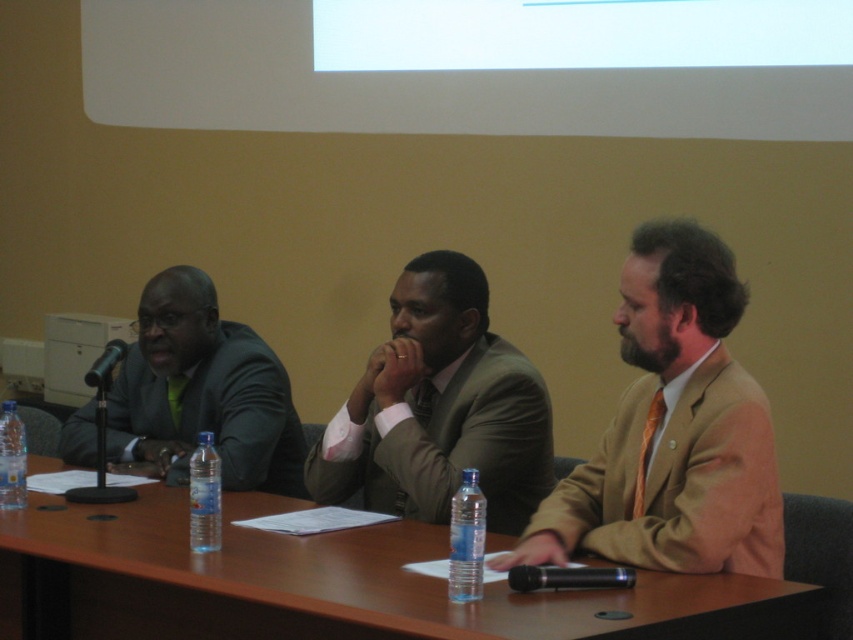
Question: Does matte brown suit at center have a lesser width compared to matte black suit at left?

Choices:
 (A) no
 (B) yes

Answer: (B)

Question: Is matte brown suit at center to the right of matte black suit at left from the viewer's perspective?

Choices:
 (A) no
 (B) yes

Answer: (B)

Question: Is matte black suit at left thinner than clear plastic bottle at table center?

Choices:
 (A) yes
 (B) no

Answer: (B)

Question: Which point is farther to the camera?

Choices:
 (A) (688, 499)
 (B) (387, 438)
 (C) (138, 336)

Answer: (C)

Question: Which object appears farthest from the camera in this image?

Choices:
 (A) brown wooden table at center
 (B) matte brown suit at center
 (C) matte green suit at center
 (D) matte black suit at left

Answer: (D)

Question: Estimate the real-world distances between objects in this image. Which object is closer to the matte brown suit at center?

Choices:
 (A) transparent plastic water bottle at center
 (B) matte green suit at center

Answer: (A)